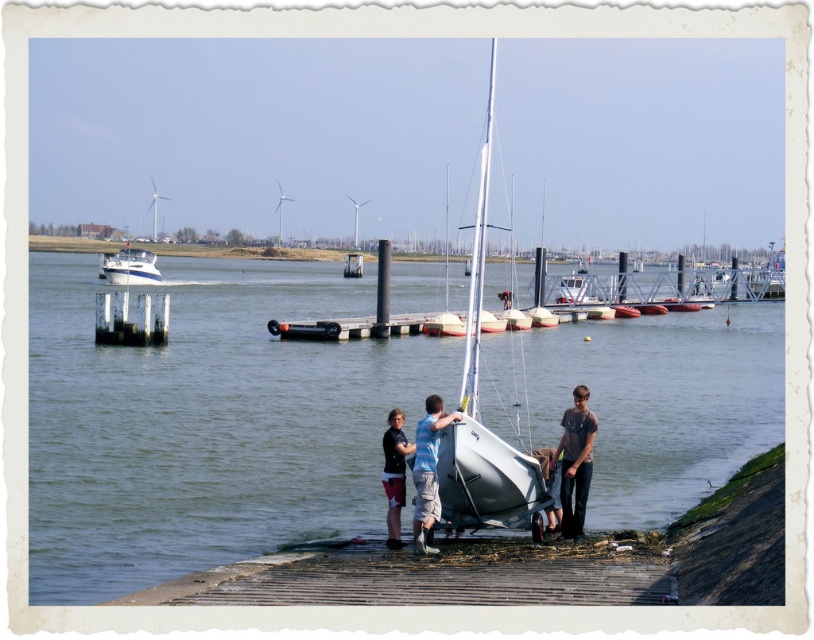
Question: Does wooden planks at lower center have a larger size compared to white matte sailboat at center?

Choices:
 (A) yes
 (B) no

Answer: (B)

Question: Estimate the real-world distances between objects in this image. Which object is farther from the dark gray jeans at lower right?

Choices:
 (A) wooden planks at lower center
 (B) white glossy boat at upper left
 (C) dark gray fabric shorts at center
 (D) white matte sailboat at center

Answer: (D)

Question: Which object appears closest to the camera in this image?

Choices:
 (A) white glossy boat at upper left
 (B) light blue fabric shirt at center
 (C) dark gray fabric shorts at center

Answer: (B)

Question: Which is farther from the white matte sailboat at center?

Choices:
 (A) dark gray jeans at lower right
 (B) light blue fabric shirt at center
 (C) wooden planks at lower center

Answer: (A)

Question: Does dark gray jeans at lower right come in front of light blue fabric shirt at center?

Choices:
 (A) no
 (B) yes

Answer: (A)

Question: Does clear water at lower center appear on the left side of light blue fabric shirt at center?

Choices:
 (A) no
 (B) yes

Answer: (B)